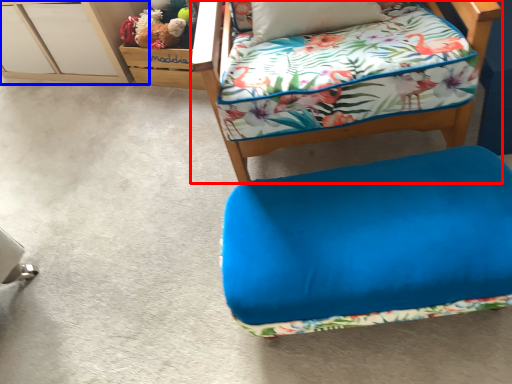
Question: Which object appears farthest to the camera in this image, furniture (highlighted by a red box) or file cabinet (highlighted by a blue box)?

Choices:
 (A) furniture
 (B) file cabinet

Answer: (B)